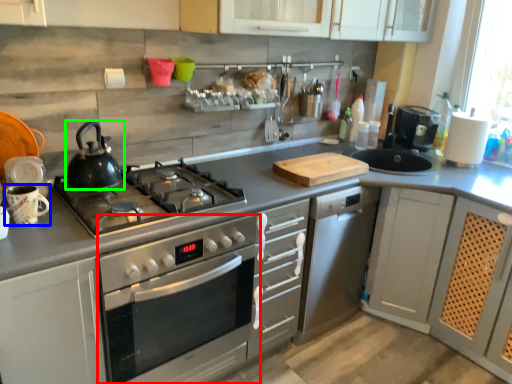
Question: Estimate the real-world distances between objects in this image. Which object is farther from oven (highlighted by a red box), appliance (highlighted by a blue box) or kitchen appliance (highlighted by a green box)?

Choices:
 (A) appliance
 (B) kitchen appliance

Answer: (A)